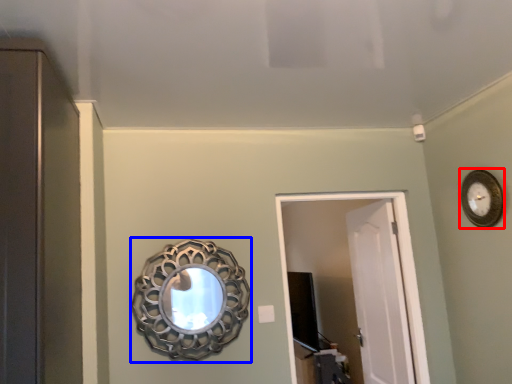
Question: Which object appears closest to the camera in this image, clock (highlighted by a red box) or mirror (highlighted by a blue box)?

Choices:
 (A) clock
 (B) mirror

Answer: (A)